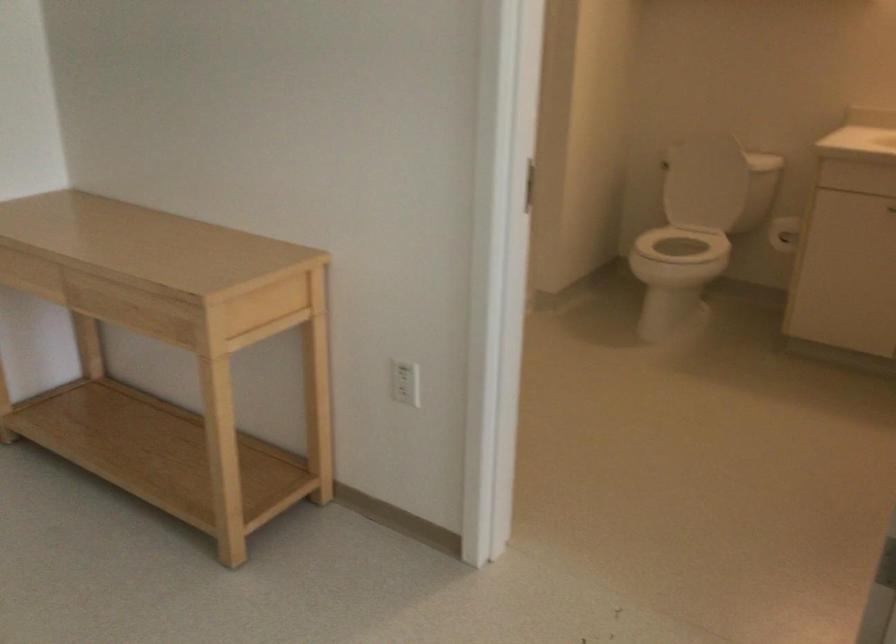
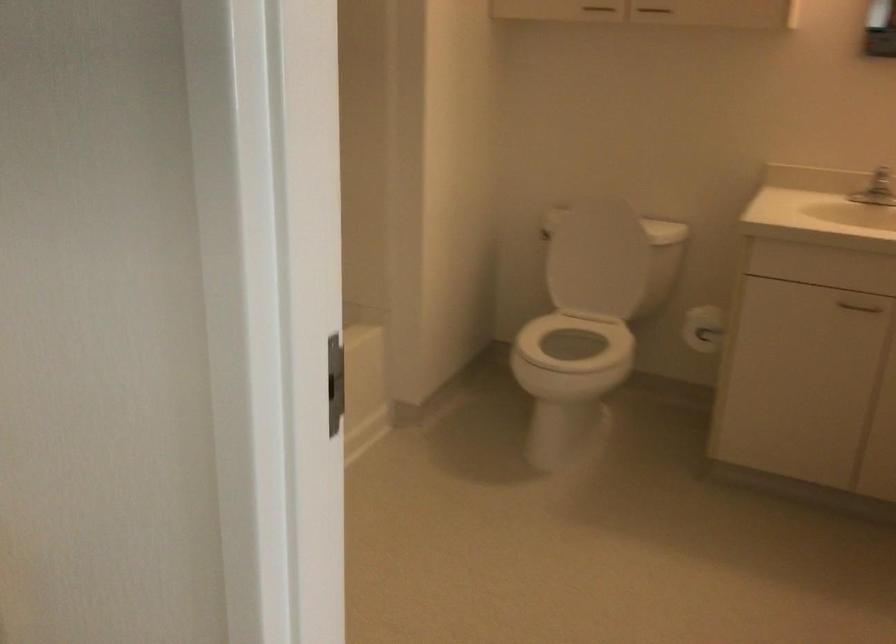
Where in the second image is the point corresponding to point (691, 254) from the first image?

(571, 357)